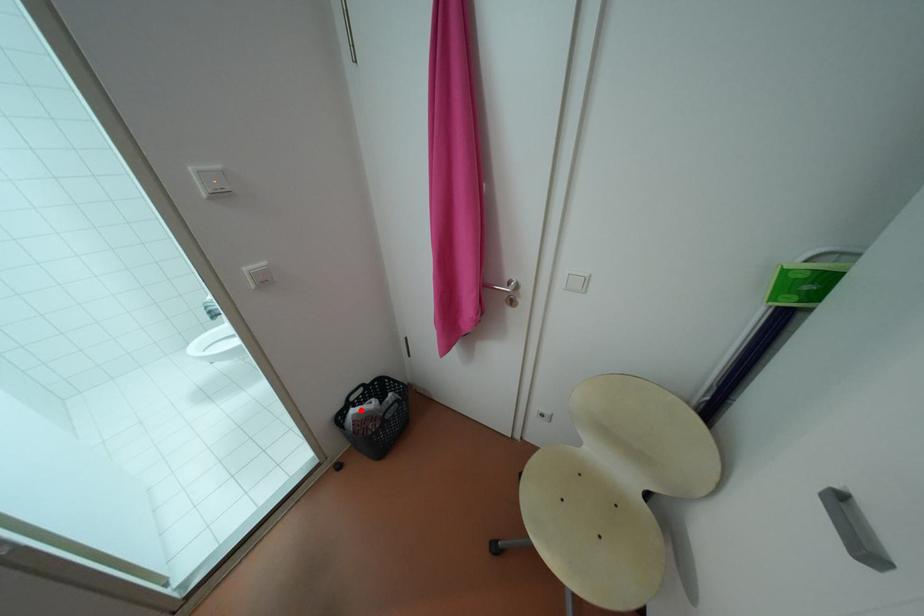
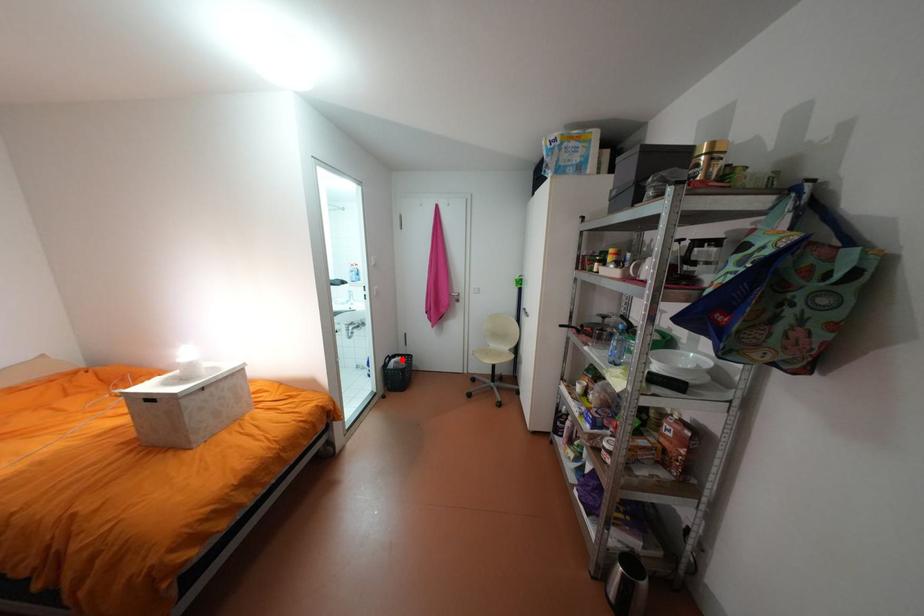
I am providing you with two images of the same scene from different viewpoints. A red point is marked on the first image and another point is marked on the second image. Does the point marked in image1 correspond to the same location as the one in image2?

Yes